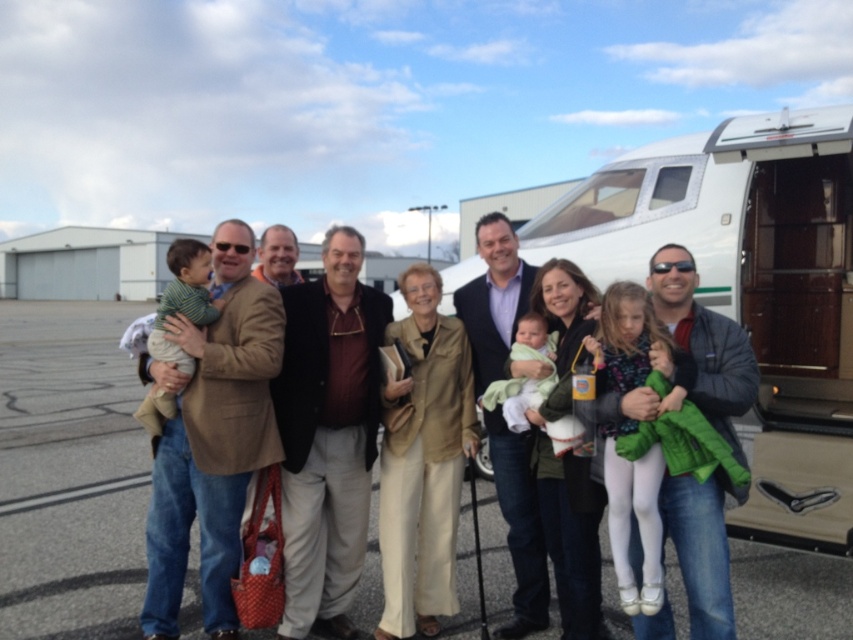
Question: Among these points, which one is farthest from the camera?

Choices:
 (A) (328, 438)
 (B) (500, 381)

Answer: (A)

Question: Which object is closer to the camera taking this photo?

Choices:
 (A) matte brown jacket at center
 (B) white soft fabric baby at center

Answer: (B)

Question: Can you confirm if white glossy recreational vehicle at right is thinner than white soft fabric baby at center?

Choices:
 (A) yes
 (B) no

Answer: (A)

Question: Is white glossy recreational vehicle at right above white soft fabric baby at center?

Choices:
 (A) yes
 (B) no

Answer: (A)

Question: Which object appears farthest from the camera in this image?

Choices:
 (A) white soft fabric baby at center
 (B) white glossy recreational vehicle at right
 (C) matte brown jacket at center

Answer: (B)

Question: Does matte brown jacket at center have a smaller size compared to white soft fabric baby at center?

Choices:
 (A) no
 (B) yes

Answer: (A)